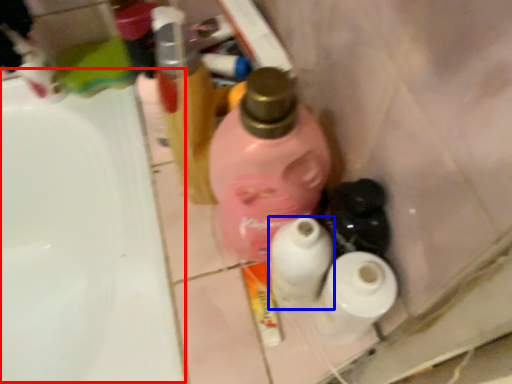
Question: Among these objects, which one is farthest to the camera, sink (highlighted by a red box) or toilet paper (highlighted by a blue box)?

Choices:
 (A) sink
 (B) toilet paper

Answer: (A)